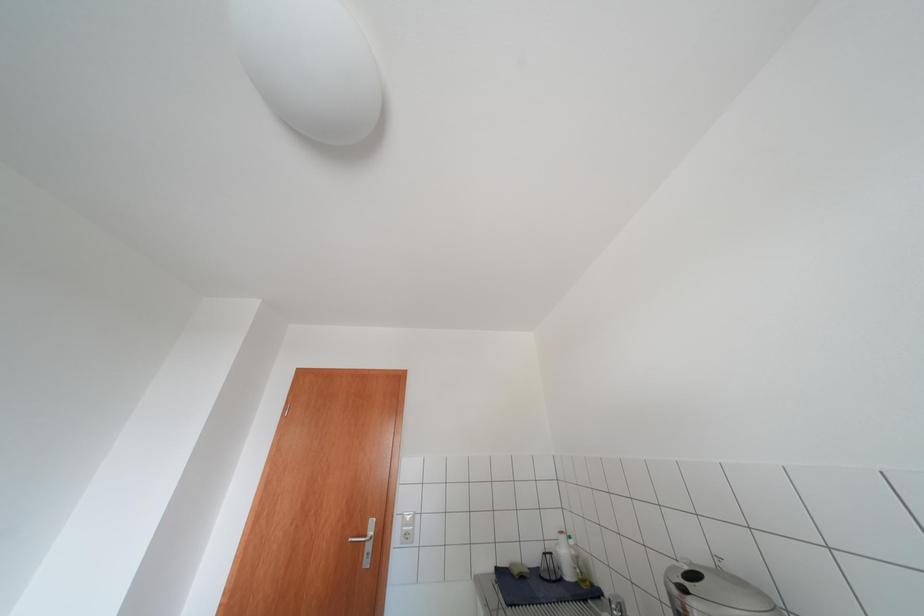
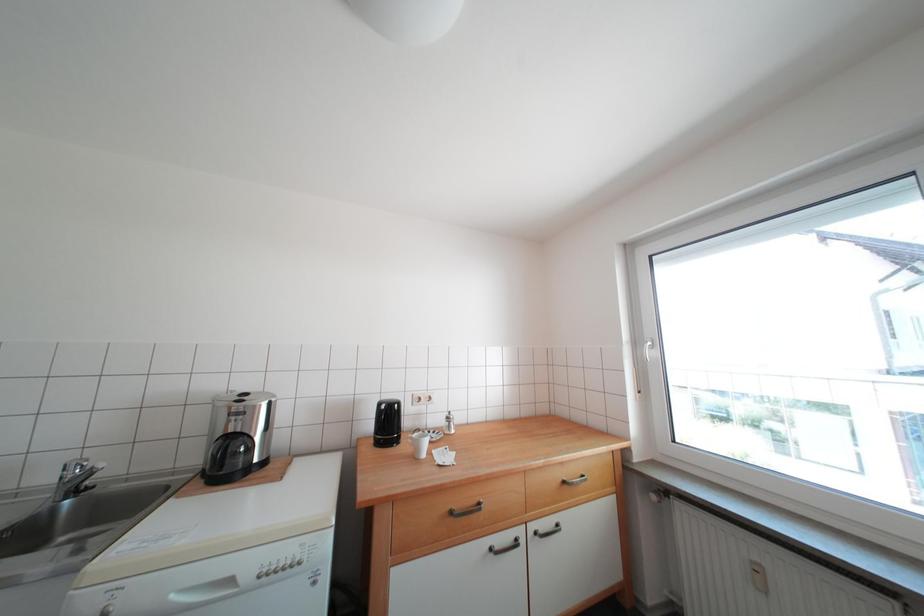
The first image is from the beginning of the video and the second image is from the end. How did the camera likely rotate when shooting the video?

The rotation direction of the camera is right-up.